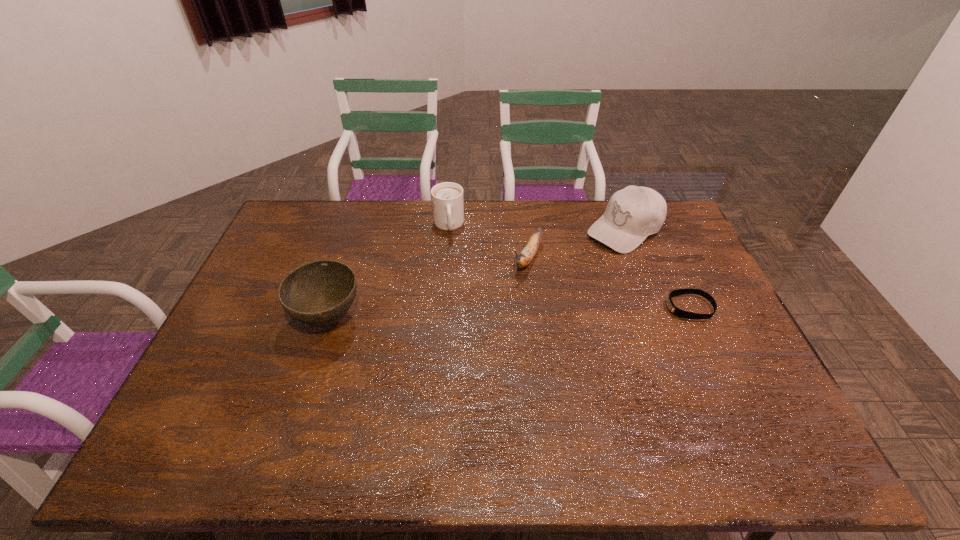
Image resolution: width=960 pixels, height=540 pixels. In order to click on free space on the desktop that is between the leftmost object and the shortest object and is positioned on the front-facing side of the baseball cap in this screenshot , I will do `click(504, 313)`.

Find the location of a particular element. The width and height of the screenshot is (960, 540). vacant space on the desktop that is between the leftmost object and the shortest object and is positioned at the stem of the fourth tallest object is located at coordinates (490, 314).

You are a GUI agent. You are given a task and a screenshot of the screen. Output one action in this format:
    pyautogui.click(x=<x>, y=<y>)
    Task: Click on the vacant space on the desktop that is between the leftmost object and the wristband and is positioned on the side with the handle of the cappuccino
    
    Given the screenshot: What is the action you would take?
    pyautogui.click(x=458, y=314)